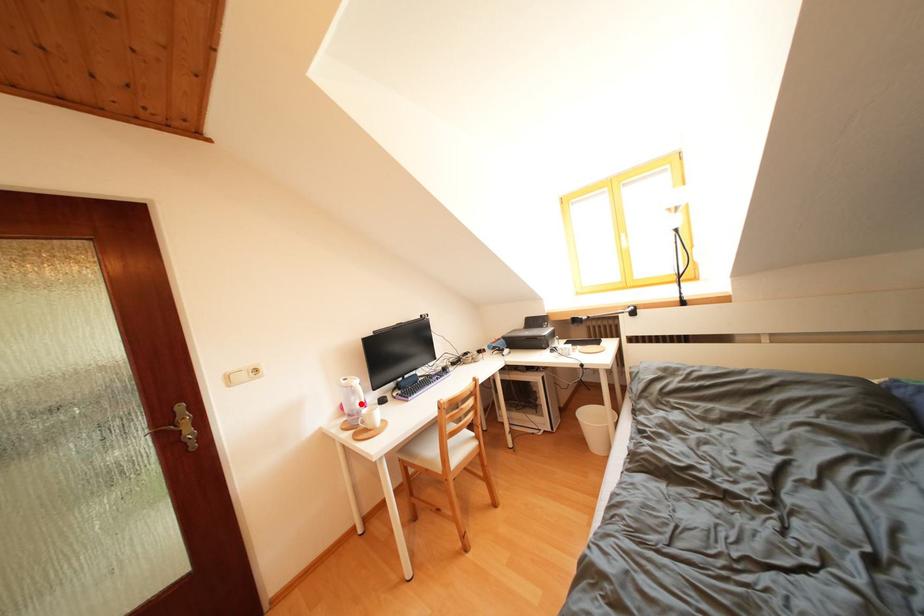
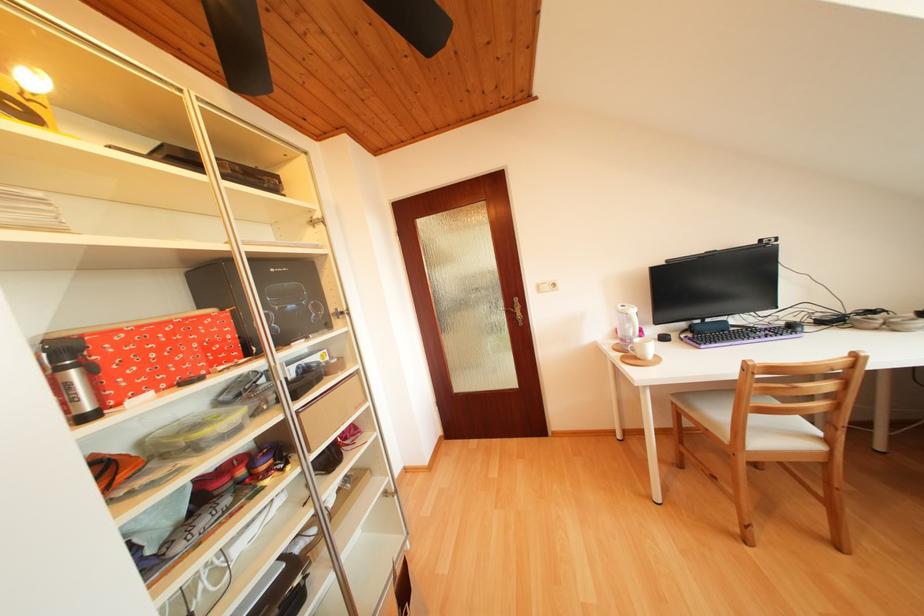
Locate, in the second image, the point that corresponds to the highlighted location in the first image.

(636, 331)